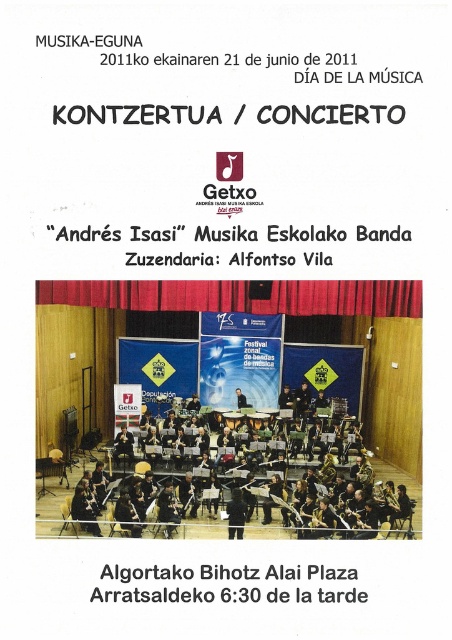
Question: Among these objects, which one is nearest to the camera?

Choices:
 (A) matte black clarinet at center
 (B) black metallic instruments at center

Answer: (B)

Question: Does black metallic instruments at center have a greater width compared to matte black clarinet at center?

Choices:
 (A) yes
 (B) no

Answer: (A)

Question: Is black metallic instruments at center in front of matte black clarinet at center?

Choices:
 (A) yes
 (B) no

Answer: (A)

Question: Does black metallic instruments at center have a smaller size compared to matte black clarinet at center?

Choices:
 (A) yes
 (B) no

Answer: (B)